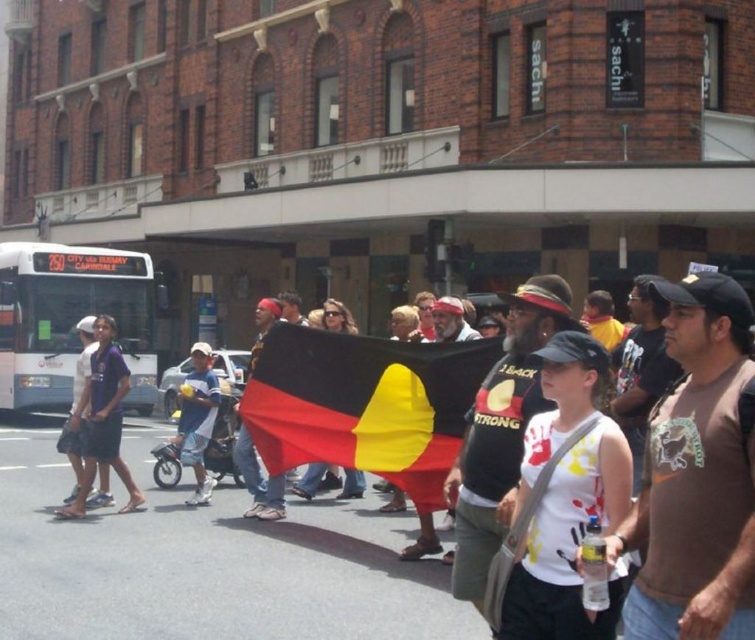
Is point (676, 616) behind point (125, 378)?

No, (676, 616) is in front of (125, 378).

Does brown cotton t-shirt at center-right appear under dark blue shorts at left?

Incorrect, brown cotton t-shirt at center-right is not positioned below dark blue shorts at left.

Describe the element at coordinates (698, 476) in the screenshot. The width and height of the screenshot is (755, 640). I see `brown cotton t-shirt at center-right` at that location.

In order to click on brown cotton t-shirt at center-right in this screenshot , I will do `click(698, 476)`.

Is dark blue shorts at left positioned at the back of blue denim shorts at center?

No.

Is point (113, 432) closer to camera compared to point (207, 392)?

Yes.

The width and height of the screenshot is (755, 640). Describe the element at coordinates (103, 419) in the screenshot. I see `dark blue shorts at left` at that location.

Locate an element on the screen. Image resolution: width=755 pixels, height=640 pixels. dark blue shorts at left is located at coordinates (103, 419).

Is blue denim shorts at center bigger than dark blue jeans at left?

No.

Is blue denim shorts at center thinner than dark blue jeans at left?

No.

Between point (205, 432) and point (69, 452), which one is positioned behind?

Point (205, 432)

Locate an element on the screen. The width and height of the screenshot is (755, 640). blue denim shorts at center is located at coordinates (196, 419).